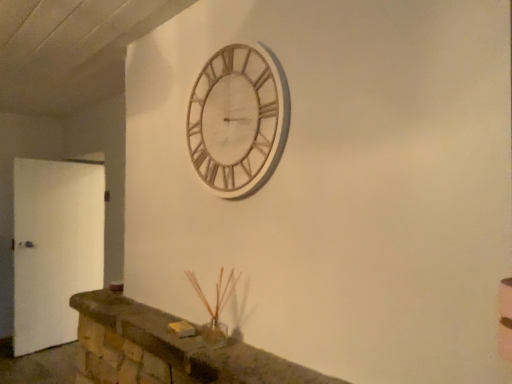
Question: Is white matte door at left wider than brown stone mantle at lower center?

Choices:
 (A) no
 (B) yes

Answer: (A)

Question: Considering the relative sizes of white matte door at left and brown stone mantle at lower center in the image provided, is white matte door at left smaller than brown stone mantle at lower center?

Choices:
 (A) no
 (B) yes

Answer: (A)

Question: Considering the relative positions of white matte door at left and brown stone mantle at lower center in the image provided, is white matte door at left to the left of brown stone mantle at lower center from the viewer's perspective?

Choices:
 (A) yes
 (B) no

Answer: (A)

Question: Does white matte door at left have a greater height compared to brown stone mantle at lower center?

Choices:
 (A) yes
 (B) no

Answer: (A)

Question: Is brown stone mantle at lower center at the back of white matte door at left?

Choices:
 (A) no
 (B) yes

Answer: (A)

Question: Does point (99, 340) appear closer or farther from the camera than point (56, 297)?

Choices:
 (A) farther
 (B) closer

Answer: (B)

Question: Considering the positions of brown stone mantle at lower center and white matte door at left in the image, is brown stone mantle at lower center bigger or smaller than white matte door at left?

Choices:
 (A) small
 (B) big

Answer: (A)

Question: Visually, is brown stone mantle at lower center positioned to the left or to the right of white matte door at left?

Choices:
 (A) right
 (B) left

Answer: (A)

Question: Is brown stone mantle at lower center wider or thinner than white matte door at left?

Choices:
 (A) wide
 (B) thin

Answer: (A)

Question: Considering their positions, is white matte door at left located in front of or behind brown stone mantle at lower center?

Choices:
 (A) front
 (B) behind

Answer: (B)

Question: From a real-world perspective, is white matte door at left above or below brown stone mantle at lower center?

Choices:
 (A) above
 (B) below

Answer: (A)

Question: Considering the positions of white matte door at left and brown stone mantle at lower center in the image, is white matte door at left bigger or smaller than brown stone mantle at lower center?

Choices:
 (A) small
 (B) big

Answer: (B)

Question: In terms of height, does white matte door at left look taller or shorter compared to brown stone mantle at lower center?

Choices:
 (A) tall
 (B) short

Answer: (A)

Question: From a real-world perspective, is white matte door at left positioned above or below wooden clock at upper center?

Choices:
 (A) below
 (B) above

Answer: (A)

Question: From the image's perspective, is white matte door at left above or below wooden clock at upper center?

Choices:
 (A) below
 (B) above

Answer: (A)